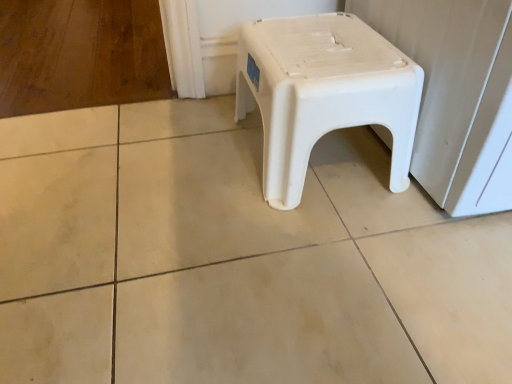
Question: Is white plastic stool at center inside or outside of white plastic stool at center-right?

Choices:
 (A) outside
 (B) inside

Answer: (A)

Question: From the image's perspective, relative to white plastic stool at center-right, is white plastic stool at center above or below?

Choices:
 (A) below
 (B) above

Answer: (A)

Question: Is point (346, 44) closer or farther from the camera than point (425, 74)?

Choices:
 (A) closer
 (B) farther

Answer: (B)

Question: Choose the correct answer: Is white plastic stool at center-right inside white plastic stool at center or outside it?

Choices:
 (A) outside
 (B) inside

Answer: (A)

Question: Considering the positions of white plastic stool at center-right and white plastic stool at center in the image, is white plastic stool at center-right bigger or smaller than white plastic stool at center?

Choices:
 (A) big
 (B) small

Answer: (A)

Question: In the image, is white plastic stool at center-right positioned in front of or behind white plastic stool at center?

Choices:
 (A) front
 (B) behind

Answer: (A)

Question: Considering the positions of white plastic stool at center-right and white plastic stool at center in the image, is white plastic stool at center-right taller or shorter than white plastic stool at center?

Choices:
 (A) short
 (B) tall

Answer: (B)